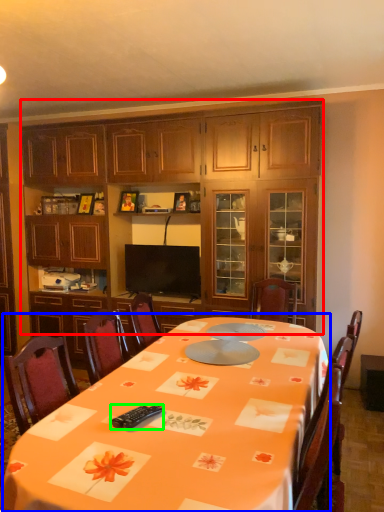
Question: Which object is positioned farthest from cabinetry (highlighted by a red box)? Select from round table (highlighted by a blue box) and remote control (highlighted by a green box).

Choices:
 (A) round table
 (B) remote control

Answer: (B)